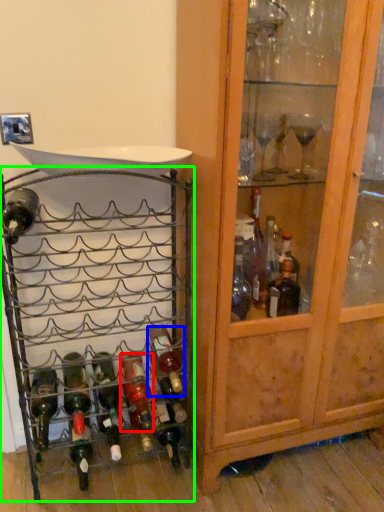
Question: Considering the real-world distances, which object is farthest from bottle (highlighted by a red box)? bottle (highlighted by a blue box) or shelf (highlighted by a green box)?

Choices:
 (A) bottle
 (B) shelf

Answer: (B)